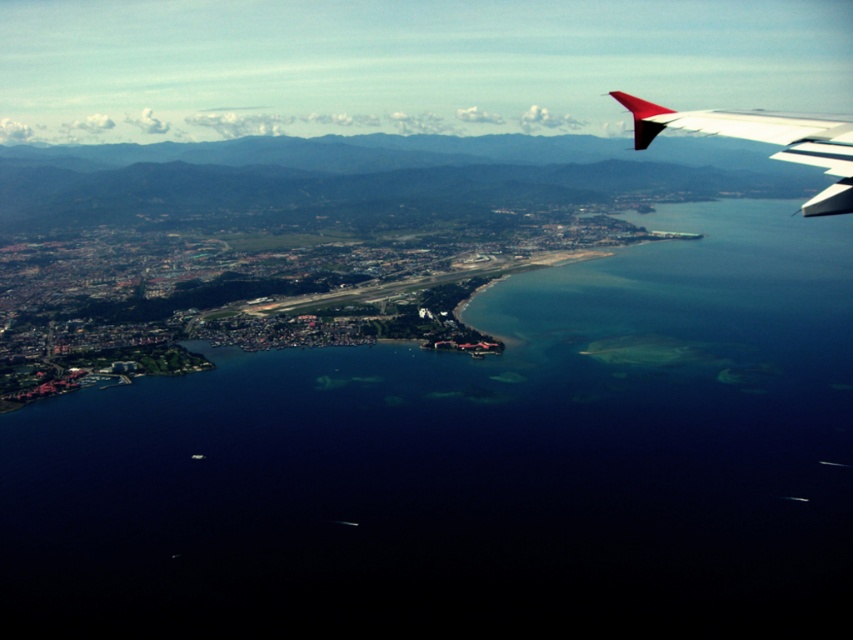
Based on the photo, you are a drone operator planning to fly a drone from your current position to a specific point marked as point (x=642, y=452) in the image. Given that the drone has a maximum flight range of 2000 feet, will it be able to reach the point without needing to recharge?

The distance between point (x=642, y=452) and the camera is 2118.91 feet, which exceeds the drone maximum flight range of 2000 feet. Therefore, the drone cannot reach the point without recharging.